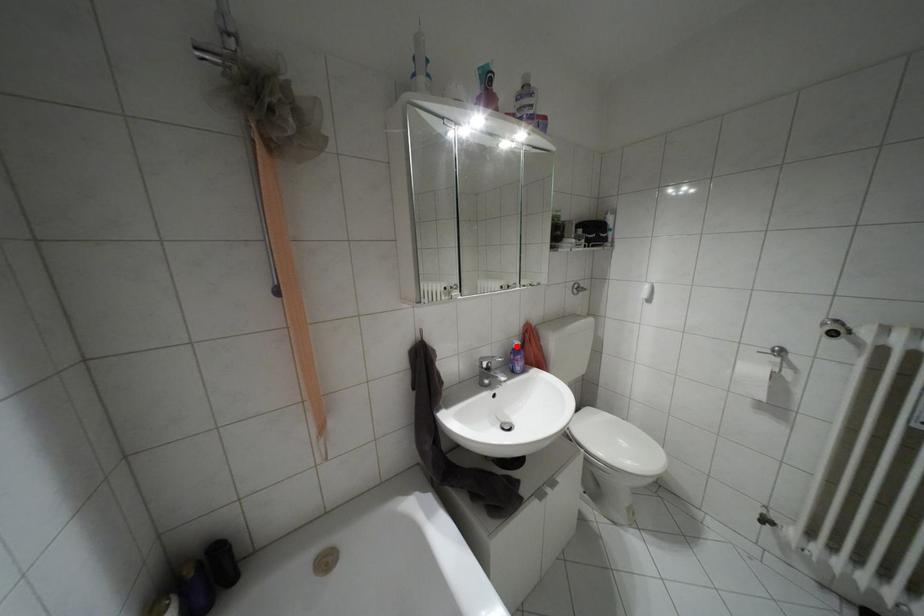
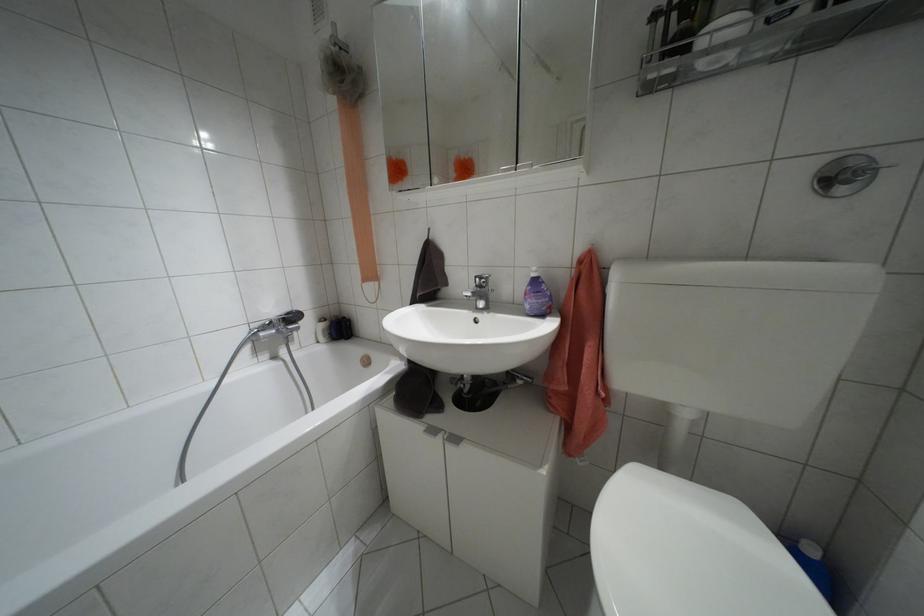
Find the pixel in the second image that matches the highlighted location in the first image.

(532, 274)